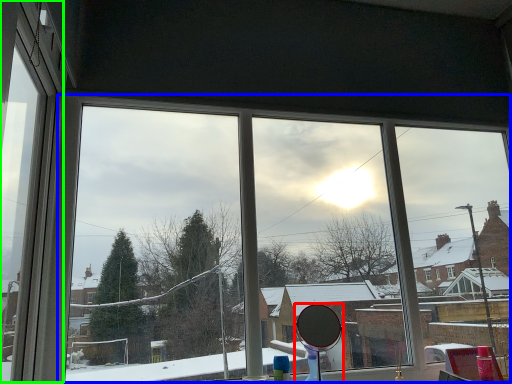
Question: Estimate the real-world distances between objects in this image. Which object is farther from mirror (highlighted by a red box), bay window (highlighted by a blue box) or window frame (highlighted by a green box)?

Choices:
 (A) bay window
 (B) window frame

Answer: (B)